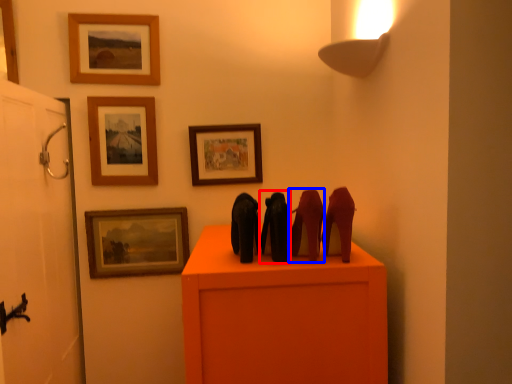
Question: Which of the following is the closest to the observer, animal (highlighted by a red box) or animal (highlighted by a blue box)?

Choices:
 (A) animal
 (B) animal

Answer: (B)